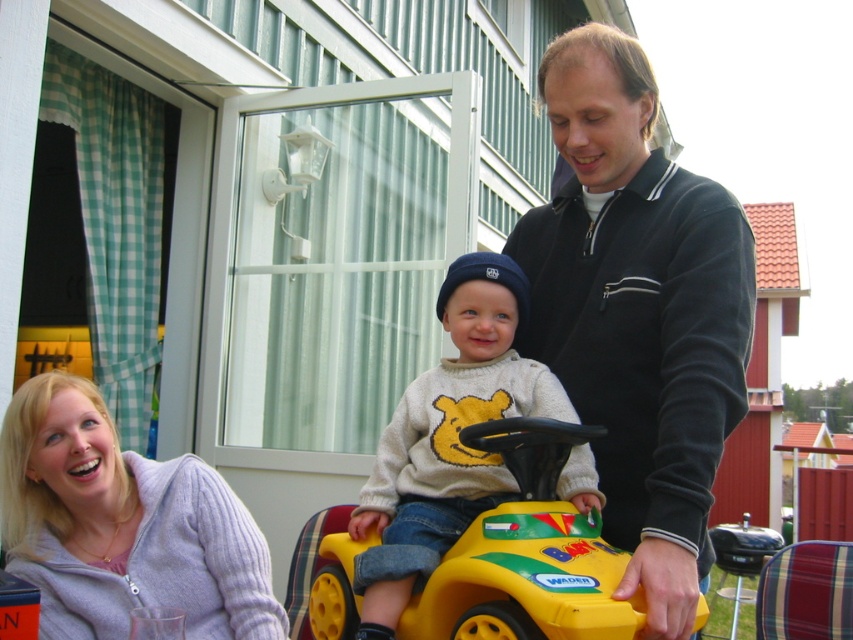
Between black fleece at center and yellow plastic toy car at center, which one appears on the left side from the viewer's perspective?

yellow plastic toy car at center

Which is above, black fleece at center or yellow plastic toy car at center?

black fleece at center is above.

Find the location of `black fleece at center`. black fleece at center is located at coordinates (637, 312).

At what (x,y) coordinates should I click in order to perform the action: click on black fleece at center. Please return your answer as a coordinate pair (x, y). This screenshot has width=853, height=640. Looking at the image, I should click on (637, 312).

Does black fleece at center have a smaller size compared to light gray sweater at center?

No, black fleece at center is not smaller than light gray sweater at center.

You are a GUI agent. You are given a task and a screenshot of the screen. Output one action in this format:
    pyautogui.click(x=<x>, y=<y>)
    Task: Click on the black fleece at center
    This screenshot has width=853, height=640.
    Given the screenshot: What is the action you would take?
    pyautogui.click(x=637, y=312)

From the picture: Between black fleece at center and light purple knit sweater at lower left, which one is positioned higher?

black fleece at center is above.

In the scene shown: Does black fleece at center have a greater width compared to light purple knit sweater at lower left?

No, black fleece at center is not wider than light purple knit sweater at lower left.

You are a GUI agent. You are given a task and a screenshot of the screen. Output one action in this format:
    pyautogui.click(x=<x>, y=<y>)
    Task: Click on the black fleece at center
    This screenshot has height=640, width=853.
    Given the screenshot: What is the action you would take?
    pyautogui.click(x=637, y=312)